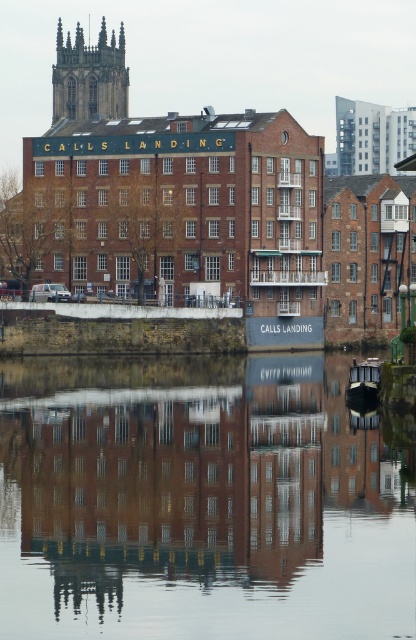
You are standing at the riverside and want to take a photo of both the smooth water at center and the dark gray stone tower at upper left. Which object will appear larger in the photo?

The smooth water at center will appear larger in the photo because it is closer to the viewer than the dark gray stone tower at upper left.

You are standing at the riverside and see two points marked in the image. Which point, point (x=116, y=476) or point (x=128, y=83), is closer to you?

Point (x=116, y=476) is closer to the viewer than point (x=128, y=83).